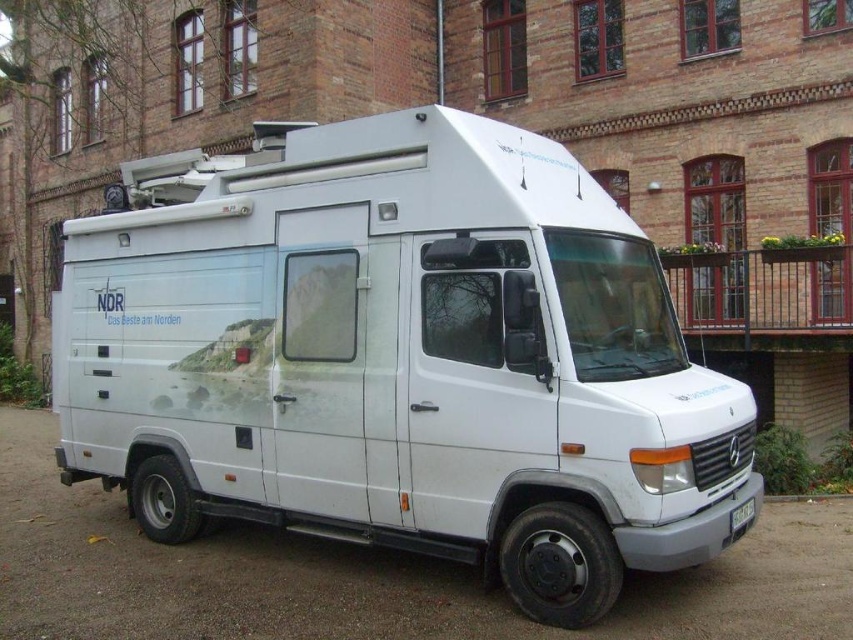
Question: Can you confirm if white glossy van at center is bigger than white plastic license plate at center?

Choices:
 (A) yes
 (B) no

Answer: (A)

Question: Which object appears farthest from the camera in this image?

Choices:
 (A) white glossy van at center
 (B) white plastic license plate at center

Answer: (B)

Question: Among these objects, which one is nearest to the camera?

Choices:
 (A) white glossy van at center
 (B) white plastic license plate at center

Answer: (A)

Question: Is white glossy van at center to the left of white plastic license plate at center from the viewer's perspective?

Choices:
 (A) no
 (B) yes

Answer: (B)

Question: From the image, what is the correct spatial relationship of white glossy van at center in relation to white plastic license plate at center?

Choices:
 (A) left
 (B) right

Answer: (A)